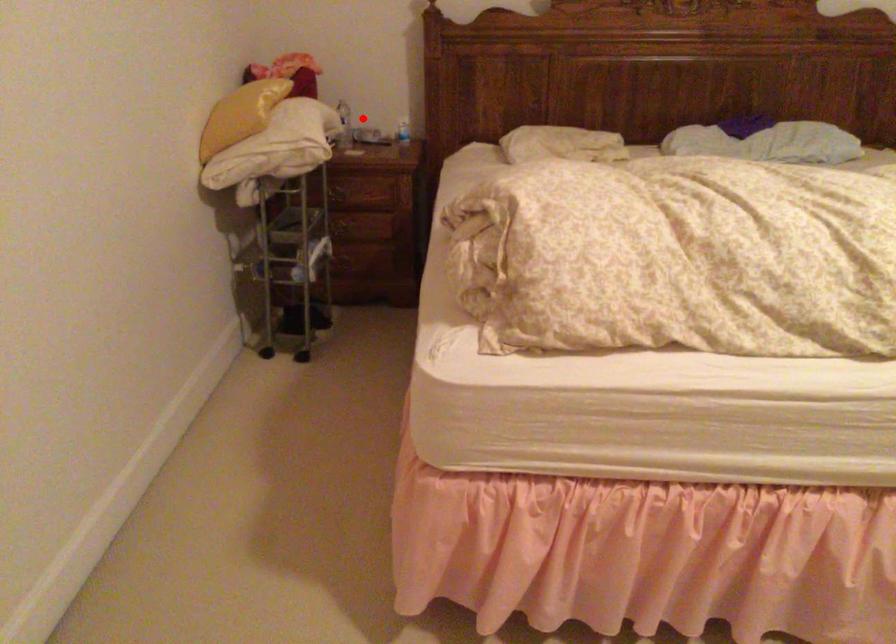
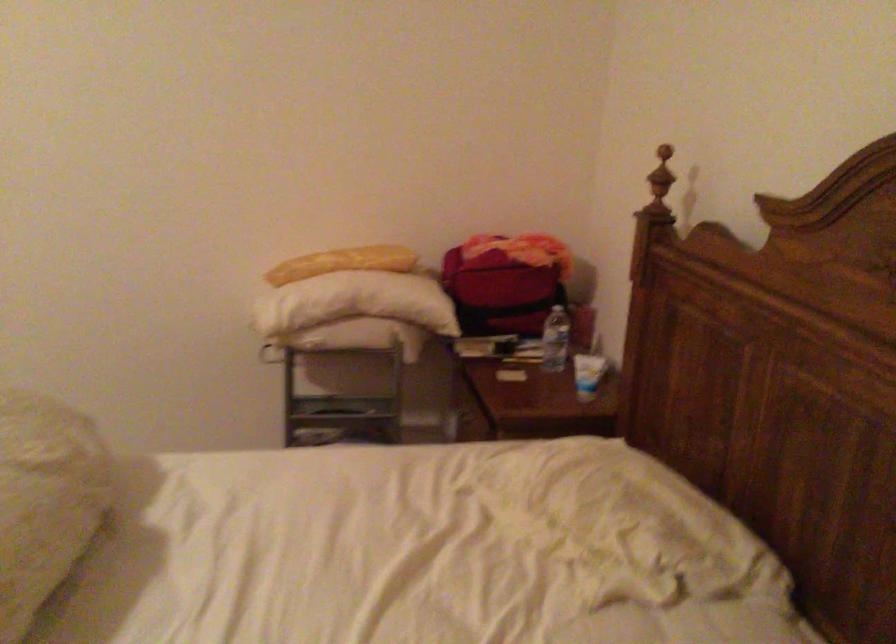
Question: I am providing you with two images of the same scene from different viewpoints. Image1 has a red point marked. In image2, the corresponding 3D location appears at what relative position? Reply with the corresponding letter.

Choices:
 (A) Closer
 (B) Farther

Answer: (A)